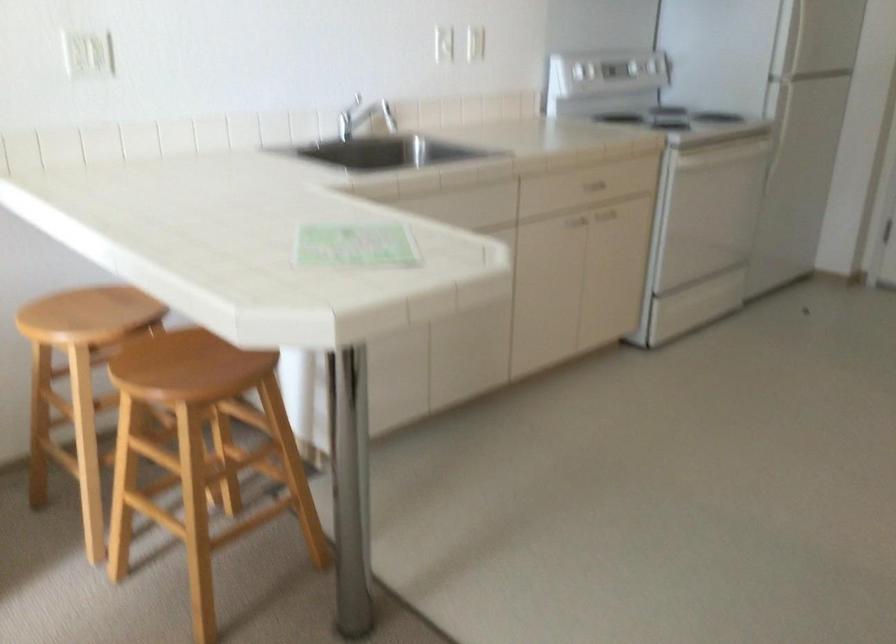
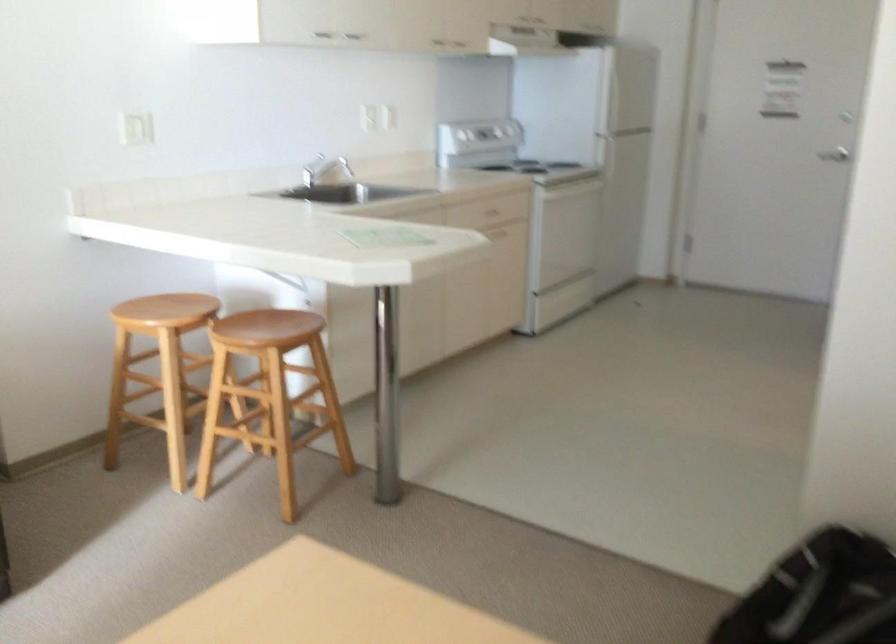
The point at [85,319] is marked in the first image. Where is the corresponding point in the second image?

(165, 310)